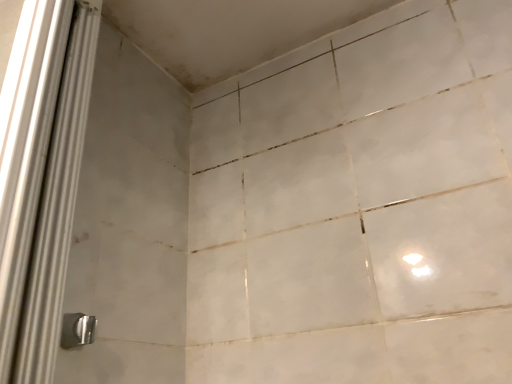
This screenshot has height=384, width=512. What do you see at coordinates (77, 330) in the screenshot? I see `polished metal door handle at bottom left` at bounding box center [77, 330].

Identify the location of polished metal door handle at bottom left. click(x=77, y=330).

You are a GUI agent. You are given a task and a screenshot of the screen. Output one action in this format:
    pyautogui.click(x=<x>, y=<y>)
    Task: Click on the polished metal door handle at bottom left
    Image resolution: width=512 pixels, height=384 pixels.
    Given the screenshot: What is the action you would take?
    pyautogui.click(x=77, y=330)